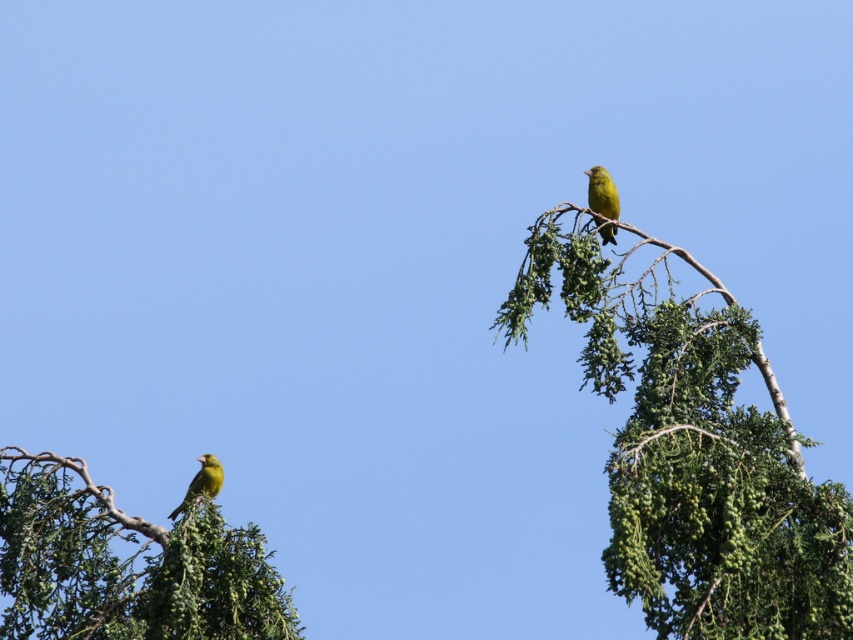
You are a birdwatcher observing two branches in the tree. The branches are labeled as green leafy branch at upper right and green leafy branch at lower left. Which branch would you recommend for a bird to land on if it prefers a larger branch?

The green leafy branch at upper right is larger in size compared to the green leafy branch at lower left, so it would be the better choice for a bird seeking a larger branch to land on.

Looking at this image, you are a birdwatcher observing the scene. You notice the green leafy branch at lower left and the bright yellow bird at upper right. Which object is larger in size?

The green leafy branch at lower left is bigger than the bright yellow bird at upper right according to the description.

You are a bird flying towards the green leafy branch at upper right and the green leafy branch at lower left. Which branch will you reach first?

The green leafy branch at lower left will be reached first because it is closer to the viewer than the green leafy branch at upper right, which is positioned further away.